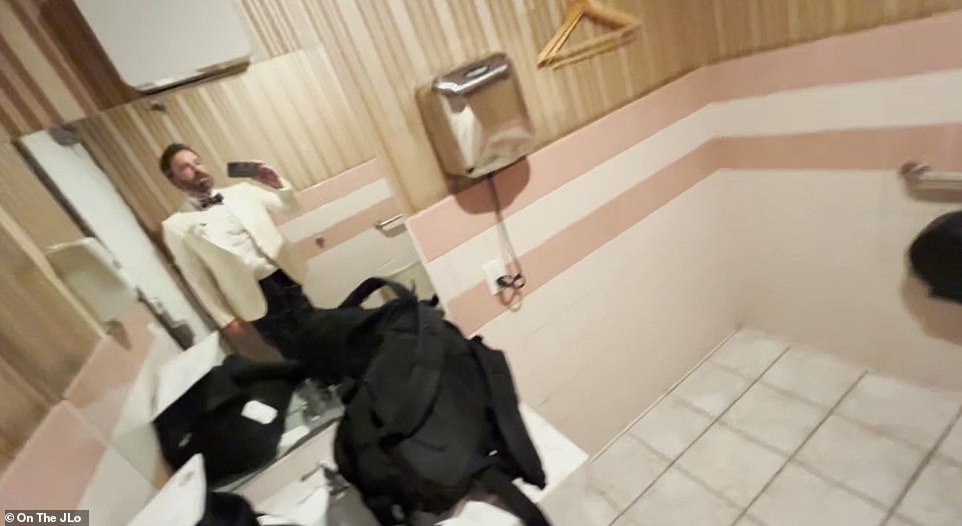
Where is `dryer`? This screenshot has width=962, height=526. dryer is located at coordinates (485, 235).